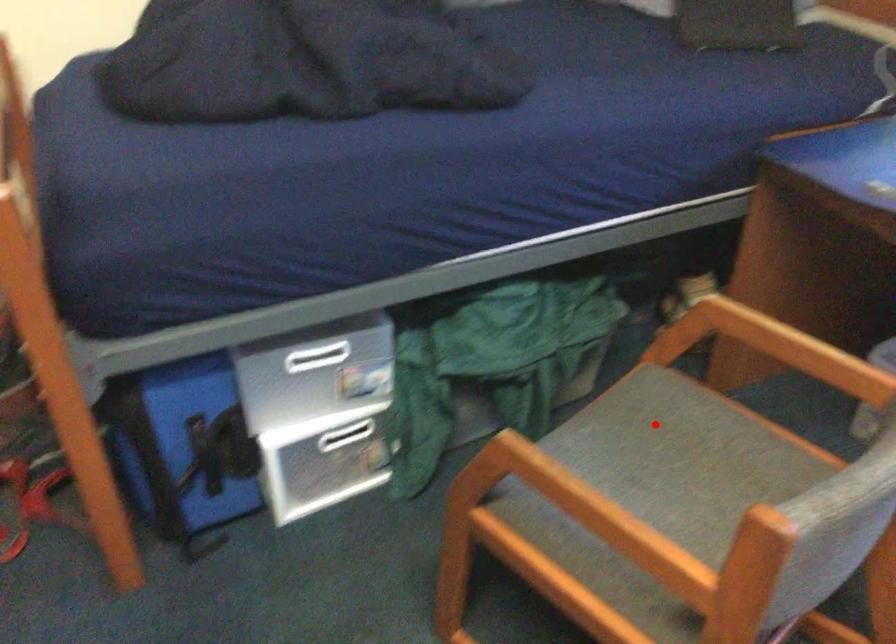
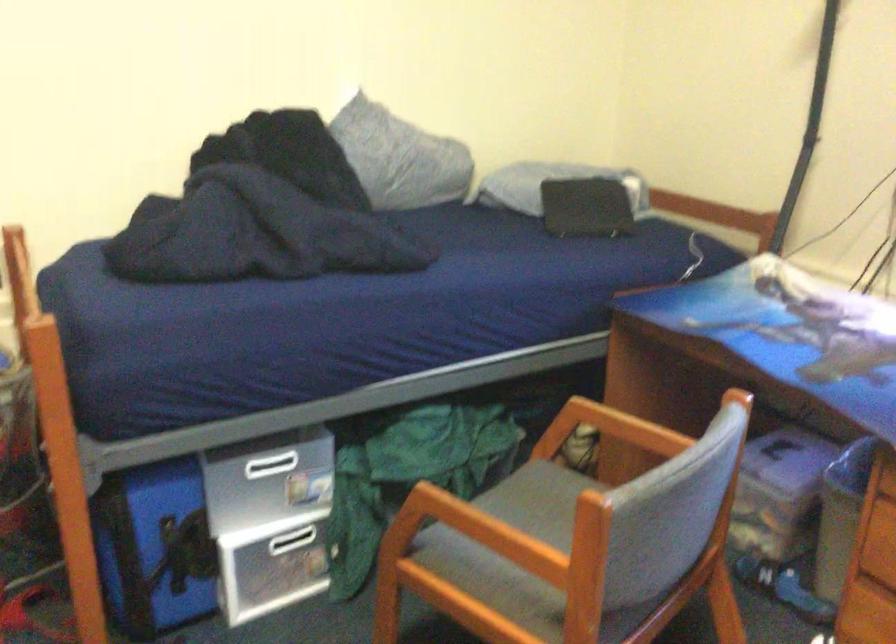
In the second image, find the point that corresponds to the highlighted location in the first image.

(540, 500)